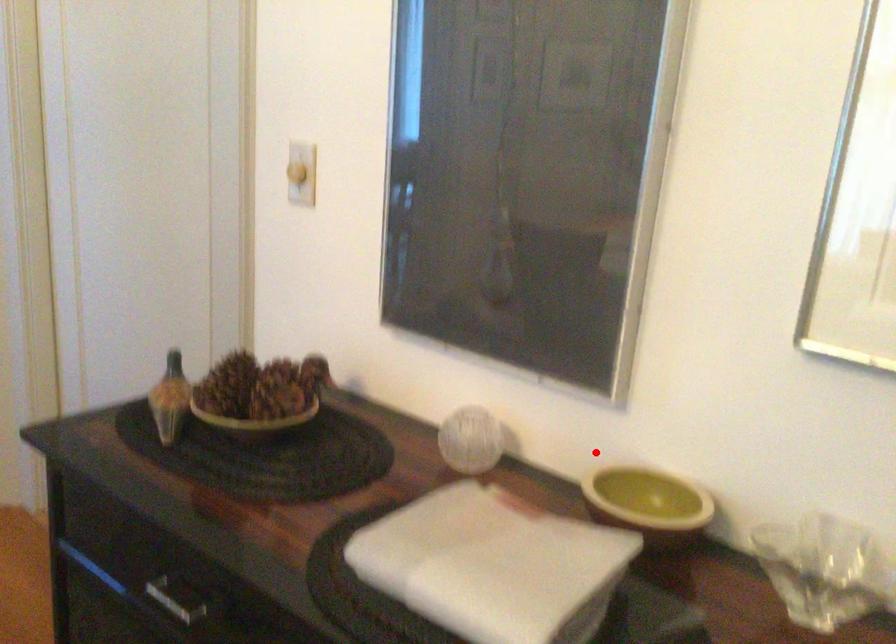
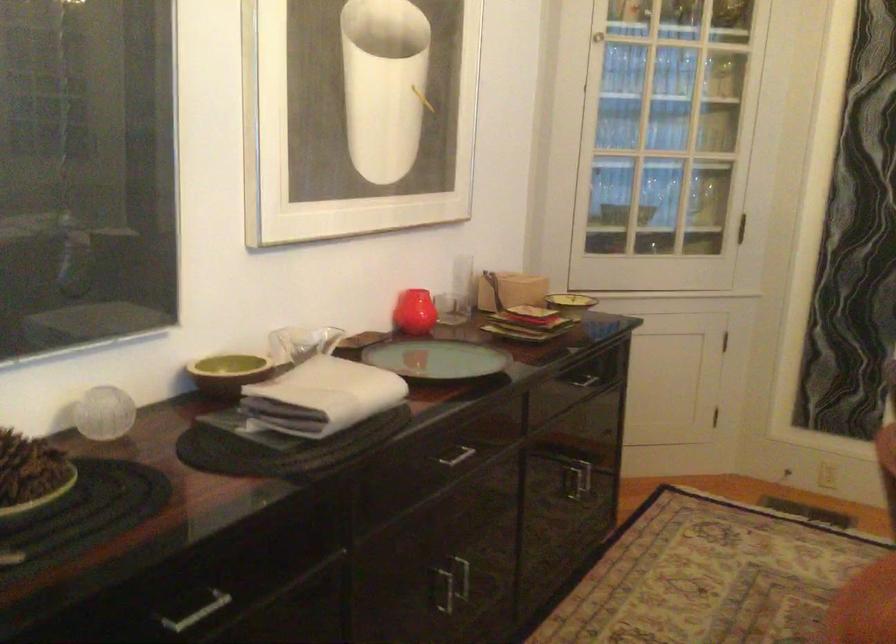
The point at the highlighted location is marked in the first image. Where is the corresponding point in the second image?

(228, 373)